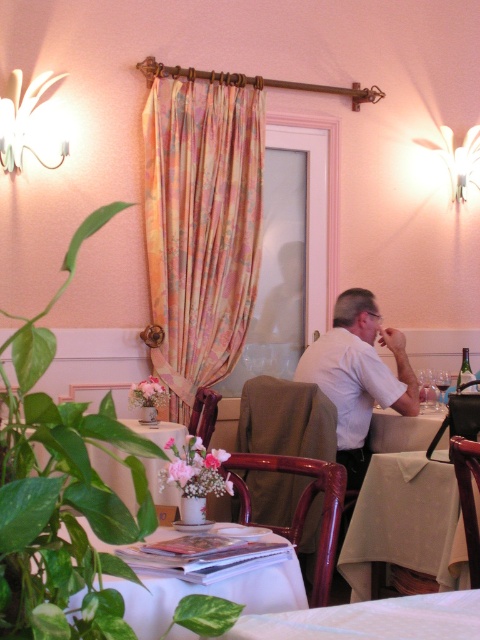
Between point (382, 627) and point (322, 531), which one is positioned behind?

The point (322, 531) is more distant.

Is point (429, 636) positioned after point (316, 483)?

No, (429, 636) is in front of (316, 483).

Find the location of a particular element. white fabric tablecloth at lower center is located at coordinates (371, 620).

Can you confirm if white paper at lower left is positioned to the left of mahogany wood chair at center?

Correct, you'll find white paper at lower left to the left of mahogany wood chair at center.

Which is in front, point (279, 580) or point (265, 452)?

Positioned in front is point (279, 580).

The image size is (480, 640). Identify the location of white paper at lower left. (210, 593).

Is white paper at lower left in front of white glossy table at lower center?

Yes.

Does white paper at lower left have a smaller size compared to white glossy table at lower center?

Correct, white paper at lower left occupies less space than white glossy table at lower center.

Is point (250, 602) positioned behind point (144, 461)?

No.

At what (x,y) coordinates should I click in order to perform the action: click on white paper at lower left. Please return your answer as a coordinate pair (x, y). The height and width of the screenshot is (640, 480). Looking at the image, I should click on (210, 593).